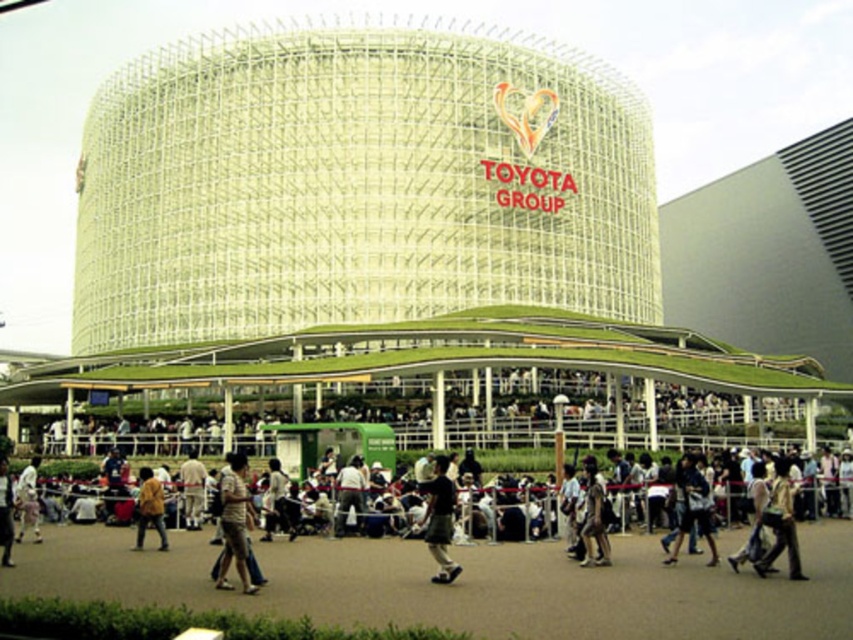
Does light brown fabric shirt at center have a lesser width compared to brown leather jacket at lower left?

No.

Is light brown fabric shirt at center smaller than brown leather jacket at lower left?

No.

Identify the location of light brown fabric shirt at center. (234, 524).

Locate an element on the screen. The height and width of the screenshot is (640, 853). light brown fabric shirt at center is located at coordinates (234, 524).

Does light brown fabric shirt at center lie in front of dark brown leather shoes at lower center?

That is True.

Is point (225, 556) positioned in front of point (595, 531)?

Yes.

Identify the location of light brown fabric shirt at center. 234,524.

Is brown leather jacket at lower left to the right of white cotton shirt at lower left from the viewer's perspective?

Indeed, brown leather jacket at lower left is positioned on the right side of white cotton shirt at lower left.

Find the location of a particular element. brown leather jacket at lower left is located at coordinates (149, 508).

Identify the location of brown leather jacket at lower left. Image resolution: width=853 pixels, height=640 pixels. (149, 508).